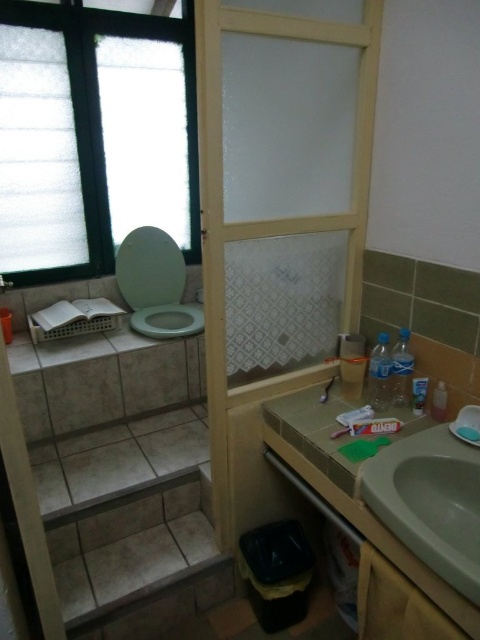
You are organizing a bathroom shelf and need to place the translucent plastic toothbrush at center and the translucent plastic toothpaste tube at lower right side by side. Which item requires more horizontal space due to its width?

The translucent plastic toothbrush at center requires more horizontal space because its width surpasses that of the translucent plastic toothpaste tube at lower right.